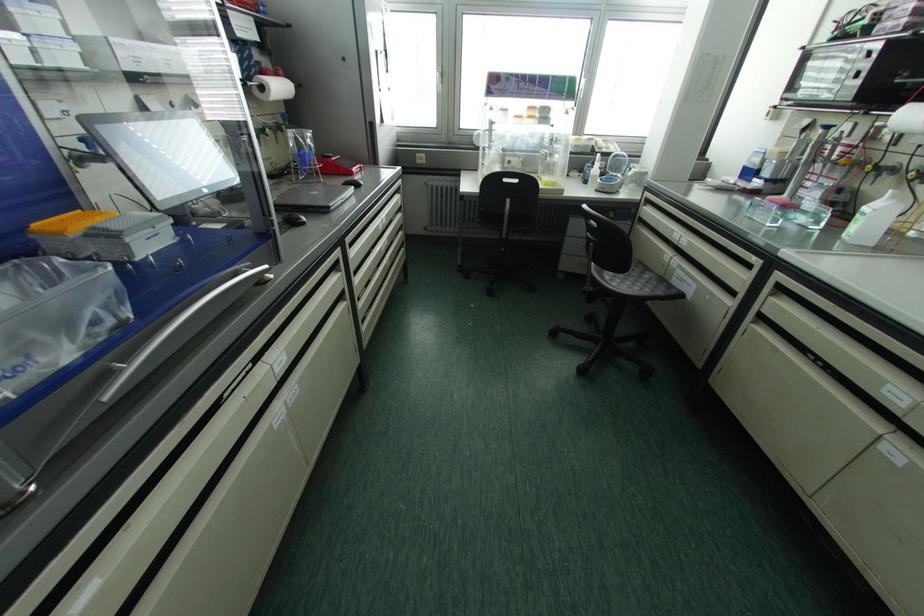
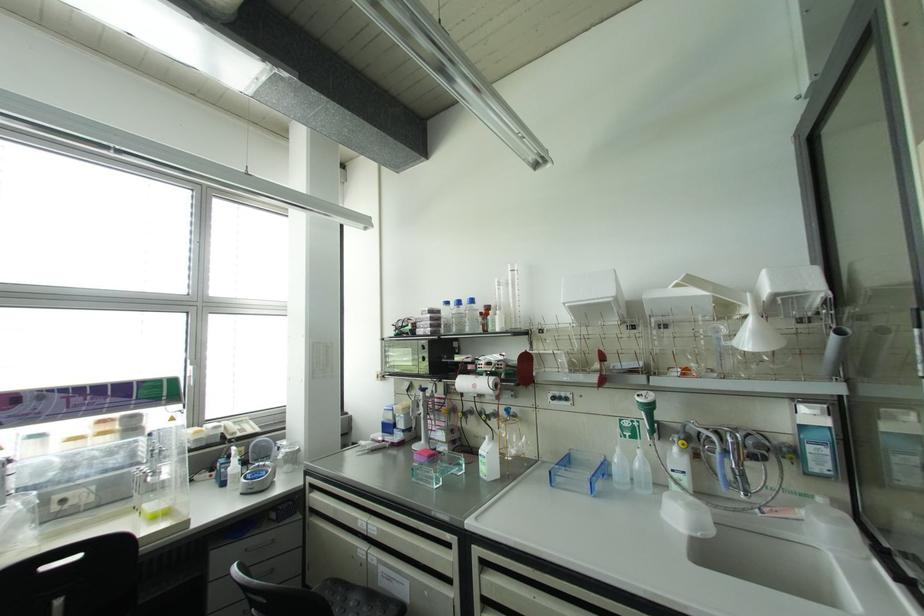
First-person continuous shooting, in which direction is the camera rotating?

The camera rotated toward right-up.